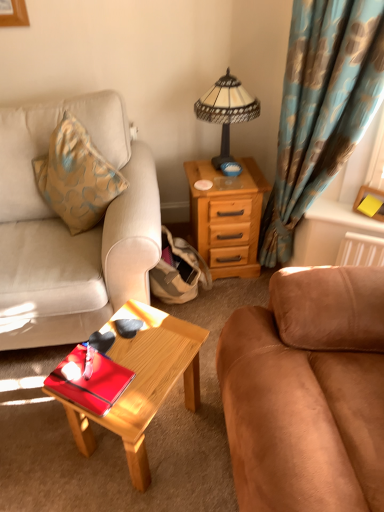
Describe the element at coordinates (68, 230) in the screenshot. I see `suede beige couch at left, the 2th studio couch viewed from the right` at that location.

This screenshot has height=512, width=384. Describe the element at coordinates (144, 382) in the screenshot. I see `shiny wood coffee table at center` at that location.

Locate an element on the screen. blue floral fabric curtain at right is located at coordinates (321, 108).

Identify the location of wooden drawer at right. This screenshot has height=512, width=384. (227, 217).

Locate an element on the screen. The image size is (384, 512). suede beige couch at left, the 1th studio couch viewed from the left is located at coordinates (68, 230).

Is suede beige couch at left, the 1th studio couch viewed from the left, located outside suede brown couch at right, the 1th studio couch when ordered from right to left?

Yes, suede beige couch at left, the 1th studio couch viewed from the left, is not within suede brown couch at right, the 1th studio couch when ordered from right to left.

Consider the image. Is suede beige couch at left, the 2th studio couch viewed from the right, positioned with its back to suede brown couch at right, the 1th studio couch when ordered from right to left?

No, suede beige couch at left, the 2th studio couch viewed from the right, is not facing away from suede brown couch at right, the 1th studio couch when ordered from right to left.

From the image's perspective, which one is positioned higher, suede beige couch at left, the 2th studio couch viewed from the right, or suede brown couch at right, which is the 2th studio couch from left to right?

suede beige couch at left, the 2th studio couch viewed from the right, appears higher in the image.

From a real-world perspective, between shiny wood coffee table at center and blue floral fabric curtain at right, who is vertically higher?

blue floral fabric curtain at right.

Which object is closer to the camera, shiny wood coffee table at center or blue floral fabric curtain at right?

shiny wood coffee table at center is more forward.

Based on their sizes in the image, would you say shiny wood coffee table at center is bigger or smaller than blue floral fabric curtain at right?

Considering their sizes, shiny wood coffee table at center takes up less space than blue floral fabric curtain at right.

Identify the location of curtain that appears above the shiny wood coffee table at center (from a real-world perspective). (321, 108).

Does point (101, 405) lie in front of point (271, 347)?

Yes, it is.

From a real-world perspective, is glossy red tray at center over suede brown couch at right, the 1th studio couch when ordered from right to left?

No, from a real-world perspective, glossy red tray at center is not over suede brown couch at right, the 1th studio couch when ordered from right to left

Considering the positions of objects glossy red tray at center and suede brown couch at right, the 1th studio couch when ordered from right to left, in the image provided, who is more to the right, glossy red tray at center or suede brown couch at right, the 1th studio couch when ordered from right to left,?

Positioned to the right is suede brown couch at right, the 1th studio couch when ordered from right to left.

Does glossy red tray at center have a lesser height compared to suede brown couch at right, which is the 2th studio couch from left to right?

Correct, glossy red tray at center is not as tall as suede brown couch at right, which is the 2th studio couch from left to right.

Consider the image. Is the depth of blue floral fabric curtain at right greater than that of shiny wood coffee table at center?

Yes, blue floral fabric curtain at right is behind shiny wood coffee table at center.

From a real-world perspective, is blue floral fabric curtain at right located beneath shiny wood coffee table at center?

Incorrect, from a real-world perspective, blue floral fabric curtain at right is higher than shiny wood coffee table at center.

Can you confirm if blue floral fabric curtain at right is wider than shiny wood coffee table at center?

In fact, blue floral fabric curtain at right might be narrower than shiny wood coffee table at center.

Find the location of a particular element. picture frame that appears on the right of stained glass lampshade at upper center is located at coordinates (374, 197).

Can you confirm if stained glass lampshade at upper center is bigger than yellow matte picture frame at upper right?

Yes.

Is point (236, 90) positioned in front of point (366, 185)?

No, it is behind (366, 185).

How different are the orientations of stained glass lampshade at upper center and yellow matte picture frame at upper right in degrees?

50.1 degrees separate the facing orientations of stained glass lampshade at upper center and yellow matte picture frame at upper right.

Can you tell me how much suede brown couch at right, the 1th studio couch when ordered from right to left, and shiny wood coffee table at center differ in facing direction?

57.1 degrees.

Is suede brown couch at right, which is the 2th studio couch from left to right, to the right of shiny wood coffee table at center from the viewer's perspective?

Yes, suede brown couch at right, which is the 2th studio couch from left to right, is to the right of shiny wood coffee table at center.

Would you say suede brown couch at right, the 1th studio couch when ordered from right to left, contains shiny wood coffee table at center?

No, shiny wood coffee table at center is located outside of suede brown couch at right, the 1th studio couch when ordered from right to left.

Locate an element on the screen. This screenshot has height=512, width=384. studio couch on the right of the shiny wood coffee table at center is located at coordinates (307, 392).

Is yellow matte picture frame at upper right situated inside suede brown couch at right, which is the 2th studio couch from left to right, or outside?

yellow matte picture frame at upper right lies outside suede brown couch at right, which is the 2th studio couch from left to right.

Who is bigger, yellow matte picture frame at upper right or suede brown couch at right, which is the 2th studio couch from left to right?

Bigger between the two is suede brown couch at right, which is the 2th studio couch from left to right.

Are yellow matte picture frame at upper right and suede brown couch at right, the 1th studio couch when ordered from right to left, making contact?

No, yellow matte picture frame at upper right is not next to suede brown couch at right, the 1th studio couch when ordered from right to left.

The image size is (384, 512). Find the location of `studio couch above the suede brown couch at right, the 1th studio couch when ordered from right to left (from the image's perspective)`. studio couch above the suede brown couch at right, the 1th studio couch when ordered from right to left (from the image's perspective) is located at coordinates point(68,230).

Where is `curtain on the right of shiny wood coffee table at center`? The height and width of the screenshot is (512, 384). curtain on the right of shiny wood coffee table at center is located at coordinates (321, 108).

Considering their positions, is glossy red tray at center positioned further to suede beige couch at left, the 2th studio couch viewed from the right, than shiny wood coffee table at center?

Among the two, glossy red tray at center is located further to suede beige couch at left, the 2th studio couch viewed from the right.

Considering their positions, is blue floral fabric curtain at right positioned closer to shiny wood coffee table at center than suede beige couch at left, the 2th studio couch viewed from the right?

suede beige couch at left, the 2th studio couch viewed from the right, is positioned closer to the anchor shiny wood coffee table at center.

Which object lies further to the anchor point blue floral fabric curtain at right, shiny wood coffee table at center or glossy red tray at center?

Based on the image, glossy red tray at center appears to be further to blue floral fabric curtain at right.

Looking at the image, which one is located closer to suede brown couch at right, which is the 2th studio couch from left to right, glossy red tray at center or yellow matte picture frame at upper right?

glossy red tray at center is closer to suede brown couch at right, which is the 2th studio couch from left to right.

Considering their positions, is shiny wood coffee table at center positioned closer to wooden drawer at right than suede beige couch at left, the 2th studio couch viewed from the right?

suede beige couch at left, the 2th studio couch viewed from the right, is closer to wooden drawer at right.

Based on their spatial positions, is blue floral fabric curtain at right or glossy red tray at center closer to suede brown couch at right, which is the 2th studio couch from left to right?

glossy red tray at center is positioned closer to the anchor suede brown couch at right, which is the 2th studio couch from left to right.

Consider the image. From the image, which object appears to be farther from blue floral fabric curtain at right, suede beige couch at left, the 2th studio couch viewed from the right, or wooden drawer at right?

suede beige couch at left, the 2th studio couch viewed from the right, is further to blue floral fabric curtain at right.

Looking at the image, which one is located closer to suede brown couch at right, which is the 2th studio couch from left to right, shiny wood coffee table at center or wooden drawer at right?

The object closer to suede brown couch at right, which is the 2th studio couch from left to right, is shiny wood coffee table at center.

Image resolution: width=384 pixels, height=512 pixels. In order to click on coffee table between suede brown couch at right, the 1th studio couch when ordered from right to left, and wooden drawer at right in the front-back direction in this screenshot , I will do `click(144, 382)`.

Identify the location of coffee table located between glossy red tray at center and suede brown couch at right, which is the 2th studio couch from left to right, in the left-right direction. (144, 382).

At what (x,y) coordinates should I click in order to perform the action: click on desk between stained glass lampshade at upper center and yellow matte picture frame at upper right. Please return your answer as a coordinate pair (x, y). This screenshot has width=384, height=512. Looking at the image, I should click on (227, 217).

At what (x,y) coordinates should I click in order to perform the action: click on desk between glossy red tray at center and yellow matte picture frame at upper right from left to right. Please return your answer as a coordinate pair (x, y). The height and width of the screenshot is (512, 384). Looking at the image, I should click on (227, 217).